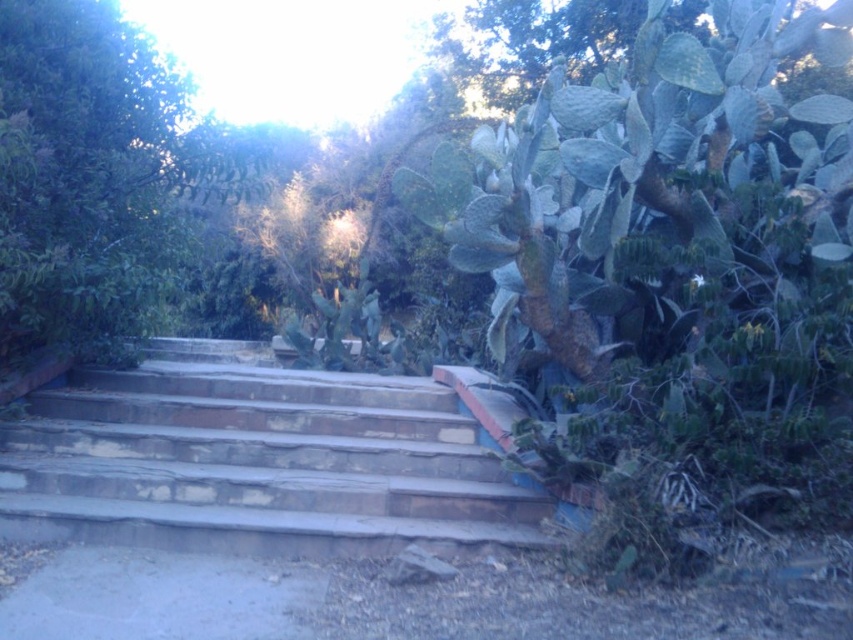
Based on the photo, is stone stairs at center to the left of green leafy tree at upper left from the viewer's perspective?

In fact, stone stairs at center is to the right of green leafy tree at upper left.

Who is more distant from viewer, (375,522) or (183,221)?

The point (183,221) is more distant.

What are the coordinates of `stone stairs at center` in the screenshot? It's located at (254, 460).